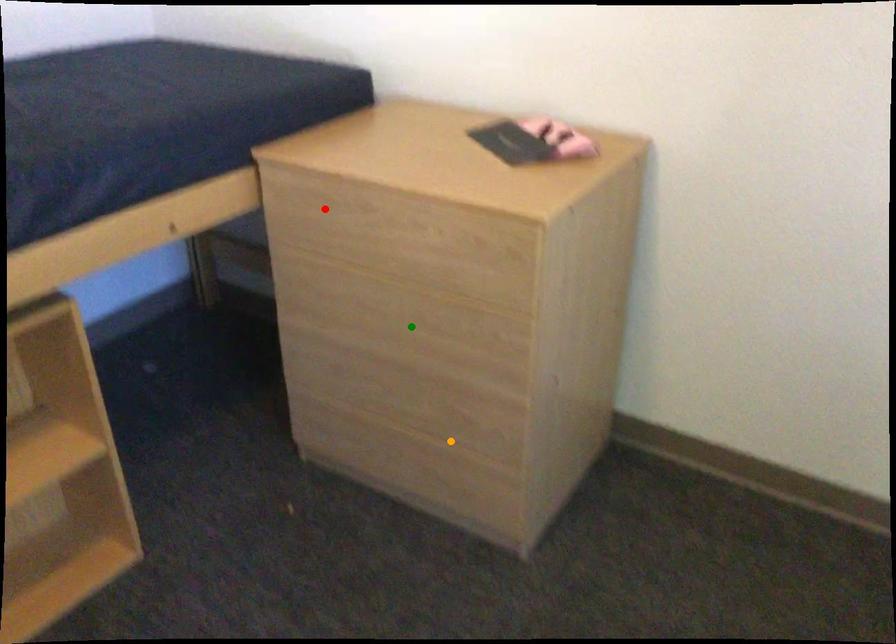
Order these from nearest to farthest:
green point | red point | orange point

red point, green point, orange point